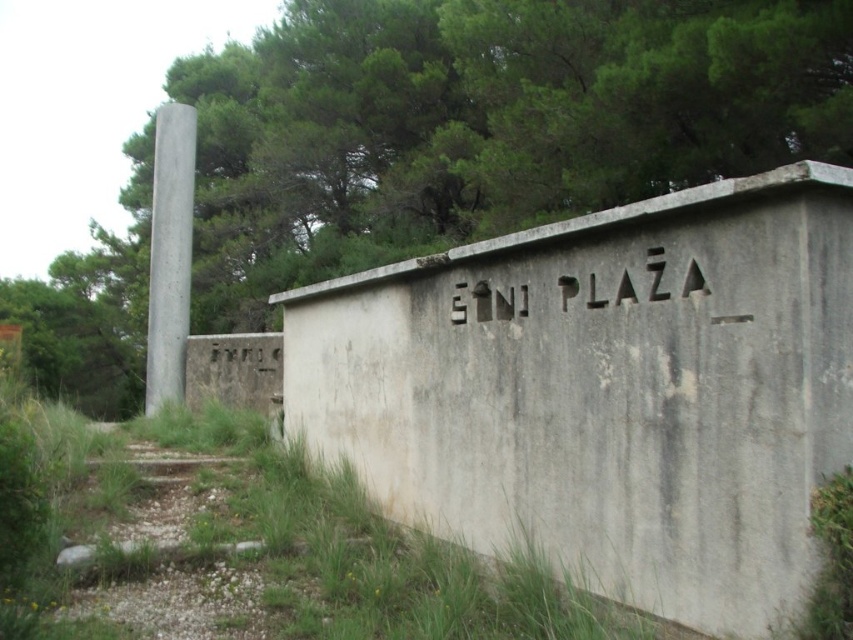
You are a delivery person trying to park your 3.5 meter wide truck between the gray concrete bunker at center and the green leafy tree at upper center. Can you fit your truck there based on the scene?

The gray concrete bunker at center is narrower than the green leafy tree at upper center, but the description only compares their widths and does not provide exact measurements. Without knowing the actual width between them, it is impossible to determine if the 3.5 meter wide truck can fit.

You are a delivery drone with a wingspan of 1.5 meters. You need to fly from the gray concrete pillar at left to the white concrete sign at upper center. Is there enough space between them for your wingspan?

The gray concrete pillar at left is 12.04 meters away from the white concrete sign at upper center, so yes, the distance between them is sufficient for the drone with a 1.5 meter wingspan to fly through.

You are standing in front of the concrete wall with the engraved words and want to walk towards the path. Which of the two points, point (166, 189) or point (521, 308), is closer to you as you face the wall?

Point (166, 189) is closer to you because it is further to the camera than point (521, 308), meaning it is nearer in your line of sight.